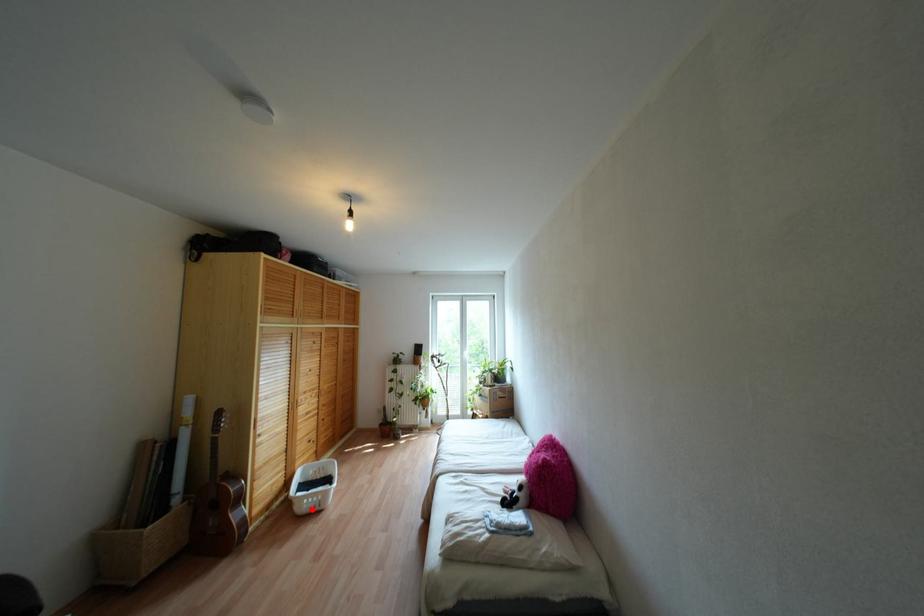
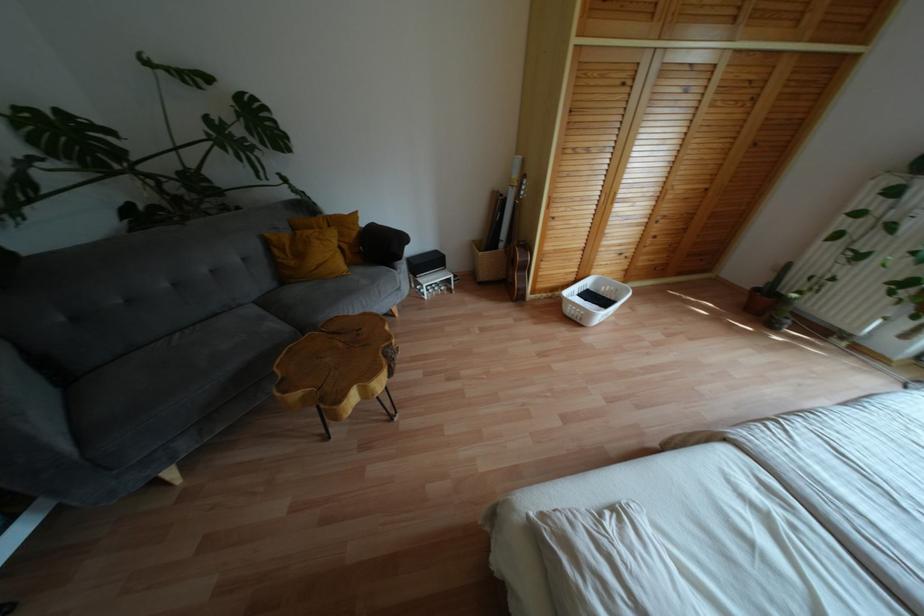
Question: I am providing you with two images of the same scene from different viewpoints. In image1, a red point is highlighted. Considering the same 3D point in image2, which of the following is correct?

Choices:
 (A) It is closer
 (B) It is farther

Answer: (A)